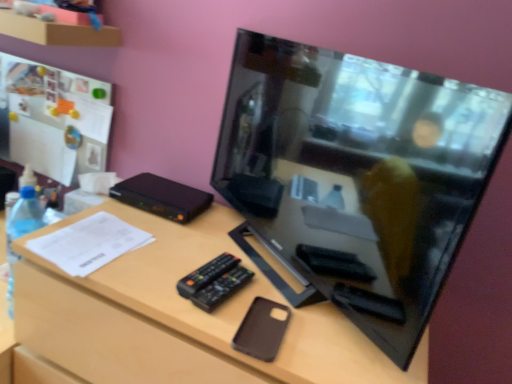
The image size is (512, 384). What are the coordinates of `vacant space to the right of black plastic remote at center` in the screenshot? It's located at (285, 297).